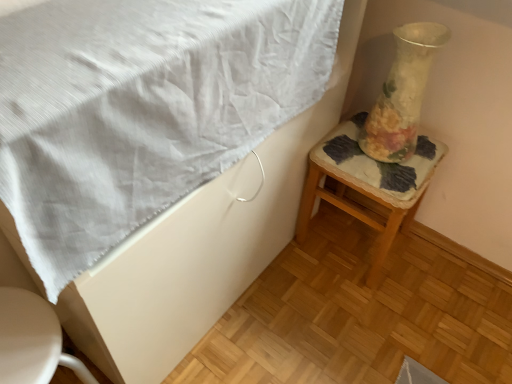
What do you see at coordinates (402, 93) in the screenshot?
I see `translucent glass vase at right` at bounding box center [402, 93].

Locate an element on the screen. This screenshot has width=512, height=384. wooden stool with floral cushion at right is located at coordinates (368, 184).

Locate an element on the screen. This screenshot has width=512, height=384. translucent glass vase at right is located at coordinates (402, 93).

Is white glossy toilet at lower left aimed at translucent glass vase at right?

No, white glossy toilet at lower left is not facing towards translucent glass vase at right.

Considering the positions of point (37, 362) and point (408, 125), is point (37, 362) closer or farther from the camera than point (408, 125)?

Point (37, 362).

From the image's perspective, who appears lower, white glossy toilet at lower left or translucent glass vase at right?

From the image's view, white glossy toilet at lower left is below.

Find the location of `furniture located below the translucent glass vase at right (from the image's perspective)`. furniture located below the translucent glass vase at right (from the image's perspective) is located at coordinates tap(32, 341).

Is white textured blanket at upper left taller than white glossy toilet at lower left?

In fact, white textured blanket at upper left may be shorter than white glossy toilet at lower left.

Which is correct: white textured blanket at upper left is inside white glossy toilet at lower left, or outside of it?

white textured blanket at upper left is outside white glossy toilet at lower left.

From a real-world perspective, is white textured blanket at upper left positioned above or below white glossy toilet at lower left?

white textured blanket at upper left is above white glossy toilet at lower left.

Looking at this image, is white textured blanket at upper left directly adjacent to white glossy toilet at lower left?

No, white textured blanket at upper left is not next to white glossy toilet at lower left.

From the image's perspective, which is below, white textured blanket at upper left or wooden stool with floral cushion at right?

wooden stool with floral cushion at right, from the image's perspective.

Which of these two, white textured blanket at upper left or wooden stool with floral cushion at right, is wider?

With larger width is white textured blanket at upper left.

Can wooden stool with floral cushion at right be found inside white textured blanket at upper left?

No, wooden stool with floral cushion at right is not a part of white textured blanket at upper left.

In the image, is translucent glass vase at right on the left side or the right side of wooden stool with floral cushion at right?

translucent glass vase at right is to the right of wooden stool with floral cushion at right.

Is translucent glass vase at right taller than wooden stool with floral cushion at right?

No, translucent glass vase at right is not taller than wooden stool with floral cushion at right.

From the image's perspective, is translucent glass vase at right located above wooden stool with floral cushion at right?

Indeed, from the image's perspective, translucent glass vase at right is shown above wooden stool with floral cushion at right.

Is translucent glass vase at right not within wooden stool with floral cushion at right?

Yes.

Is wooden stool with floral cushion at right spatially inside white glossy toilet at lower left, or outside of it?

wooden stool with floral cushion at right exists outside the volume of white glossy toilet at lower left.

Is wooden stool with floral cushion at right closer to the viewer compared to white glossy toilet at lower left?

No, it is behind white glossy toilet at lower left.

This screenshot has width=512, height=384. I want to click on stool behind the white glossy toilet at lower left, so click(368, 184).

Does wooden stool with floral cushion at right appear on the right side of white glossy toilet at lower left?

Correct, you'll find wooden stool with floral cushion at right to the right of white glossy toilet at lower left.

Consider the image. Can you tell me how much translucent glass vase at right and white glossy toilet at lower left differ in facing direction?

83.9 degrees separate the facing orientations of translucent glass vase at right and white glossy toilet at lower left.

Is translucent glass vase at right taller than white glossy toilet at lower left?

No, translucent glass vase at right is not taller than white glossy toilet at lower left.

Which of these two, translucent glass vase at right or white glossy toilet at lower left, is bigger?

Bigger between the two is white glossy toilet at lower left.

Visually, is white glossy toilet at lower left positioned to the left or to the right of wooden stool with floral cushion at right?

Based on their positions, white glossy toilet at lower left is located to the left of wooden stool with floral cushion at right.

Considering the relative sizes of white glossy toilet at lower left and wooden stool with floral cushion at right in the image provided, is white glossy toilet at lower left smaller than wooden stool with floral cushion at right?

Correct, white glossy toilet at lower left occupies less space than wooden stool with floral cushion at right.

From a real-world perspective, between white glossy toilet at lower left and wooden stool with floral cushion at right, who is vertically lower?

wooden stool with floral cushion at right.

Considering the relative sizes of white glossy toilet at lower left and wooden stool with floral cushion at right in the image provided, is white glossy toilet at lower left taller than wooden stool with floral cushion at right?

Yes.

The height and width of the screenshot is (384, 512). Identify the location of furniture that appears on the left of translucent glass vase at right. (32, 341).

Where is `furniture below the white textured blanket at upper left (from the image's perspective)`? Image resolution: width=512 pixels, height=384 pixels. furniture below the white textured blanket at upper left (from the image's perspective) is located at coordinates pos(32,341).

Looking at the image, which one is located further to translucent glass vase at right, white textured blanket at upper left or white glossy toilet at lower left?

white glossy toilet at lower left.

From the image, which object appears to be nearer to translucent glass vase at right, wooden stool with floral cushion at right or white textured blanket at upper left?

The object closer to translucent glass vase at right is wooden stool with floral cushion at right.

When comparing their distances from white textured blanket at upper left, does translucent glass vase at right or white glossy toilet at lower left seem further?

translucent glass vase at right is positioned further to the anchor white textured blanket at upper left.

Estimate the real-world distances between objects in this image. Which object is closer to wooden stool with floral cushion at right, translucent glass vase at right or white glossy toilet at lower left?

Based on the image, translucent glass vase at right appears to be nearer to wooden stool with floral cushion at right.

Which object lies further to the anchor point white glossy toilet at lower left, wooden stool with floral cushion at right or translucent glass vase at right?

Based on the image, translucent glass vase at right appears to be further to white glossy toilet at lower left.

Consider the image. Looking at the image, which one is located closer to wooden stool with floral cushion at right, white textured blanket at upper left or translucent glass vase at right?

translucent glass vase at right lies closer to wooden stool with floral cushion at right than the other object.

Considering their positions, is white textured blanket at upper left positioned closer to white glossy toilet at lower left than translucent glass vase at right?

The object closer to white glossy toilet at lower left is white textured blanket at upper left.

When comparing their distances from white textured blanket at upper left, does wooden stool with floral cushion at right or white glossy toilet at lower left seem closer?

white glossy toilet at lower left is positioned closer to the anchor white textured blanket at upper left.

Identify the location of vase between white textured blanket at upper left and wooden stool with floral cushion at right from front to back. This screenshot has width=512, height=384. (402, 93).

Identify the location of stool between white glossy toilet at lower left and translucent glass vase at right. (368, 184).

At what (x,y) coordinates should I click in order to perform the action: click on blanket situated between white glossy toilet at lower left and translucent glass vase at right from left to right. Please return your answer as a coordinate pair (x, y). This screenshot has height=384, width=512. Looking at the image, I should click on (141, 109).

Identify the location of blanket situated between white glossy toilet at lower left and wooden stool with floral cushion at right from left to right. The height and width of the screenshot is (384, 512). (141, 109).